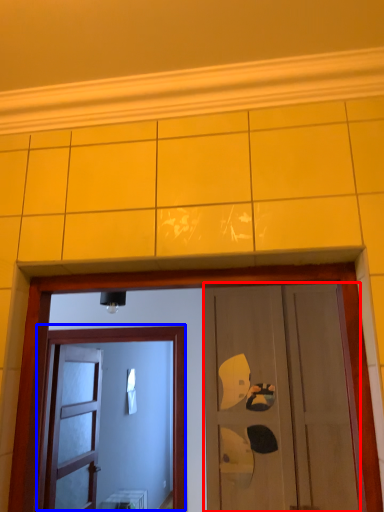
Question: Which point is closer to the camera, door (highlighted by a red box) or door (highlighted by a blue box)?

Choices:
 (A) door
 (B) door

Answer: (A)